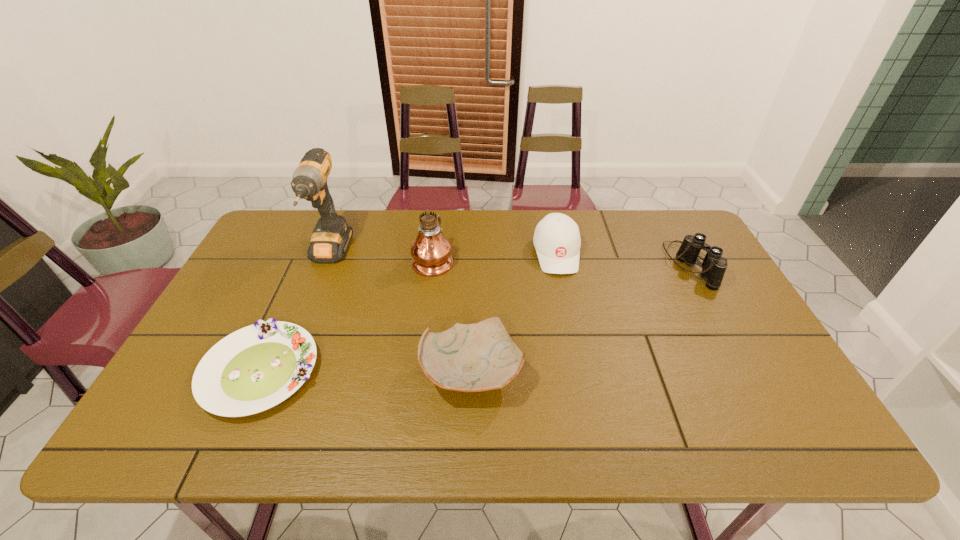
Image resolution: width=960 pixels, height=540 pixels. I want to click on object that is positioned at the near left corner, so click(255, 368).

I want to click on object located at the far right corner, so tap(714, 266).

You are a GUI agent. You are given a task and a screenshot of the screen. Output one action in this format:
    pyautogui.click(x=<x>, y=<y>)
    Task: Click on the free region at the far edge
    
    Given the screenshot: What is the action you would take?
    pyautogui.click(x=616, y=234)

You are a GUI agent. You are given a task and a screenshot of the screen. Output one action in this format:
    pyautogui.click(x=<x>, y=<y>)
    Task: Click on the free space at the near edge of the desktop
    
    Given the screenshot: What is the action you would take?
    coord(674,429)

This screenshot has height=540, width=960. In the image, there is a desktop. In order to click on free space at the left edge in this screenshot , I will do `click(240, 298)`.

Identify the location of vacant space at the right edge. Image resolution: width=960 pixels, height=540 pixels. [701, 292].

The width and height of the screenshot is (960, 540). In the image, there is a desktop. Find the location of `free space at the far left corner`. free space at the far left corner is located at coordinates (309, 215).

At what (x,y) coordinates should I click in order to perform the action: click on empty space between the salad plate and the rightmost object. Please return your answer as a coordinate pair (x, y). This screenshot has height=540, width=960. Looking at the image, I should click on (475, 319).

I want to click on free space between the second shortest object and the salad plate, so click(367, 372).

Locate an element on the screen. This screenshot has width=960, height=540. free space that is in between the salad plate and the oil lamp is located at coordinates (347, 315).